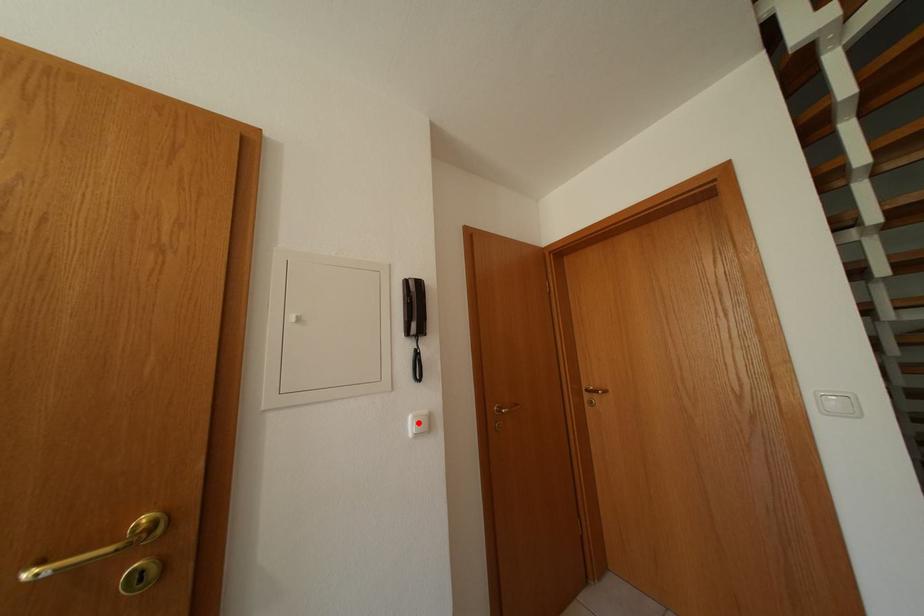
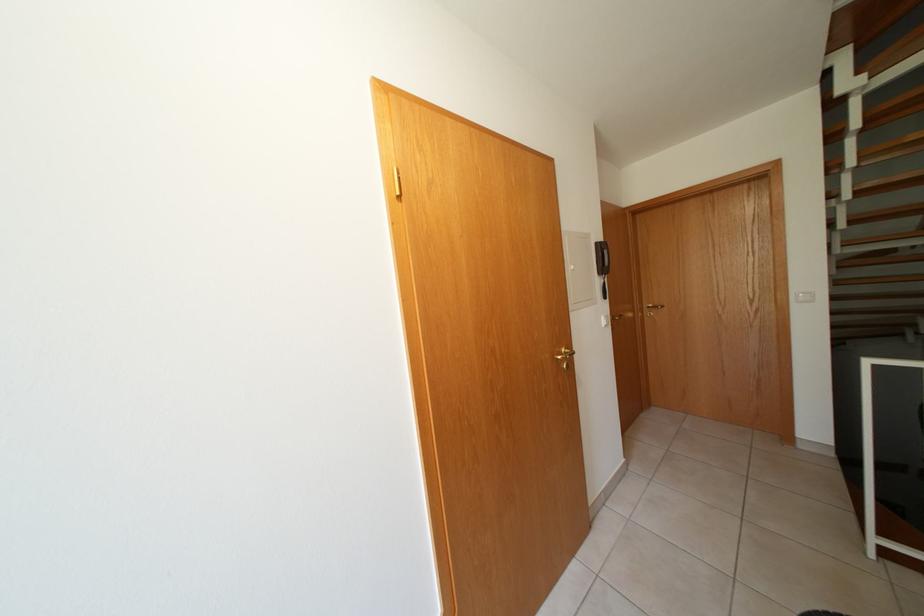
Where in the second image is the point corresponding to the highlighted location from the first image?

(611, 323)